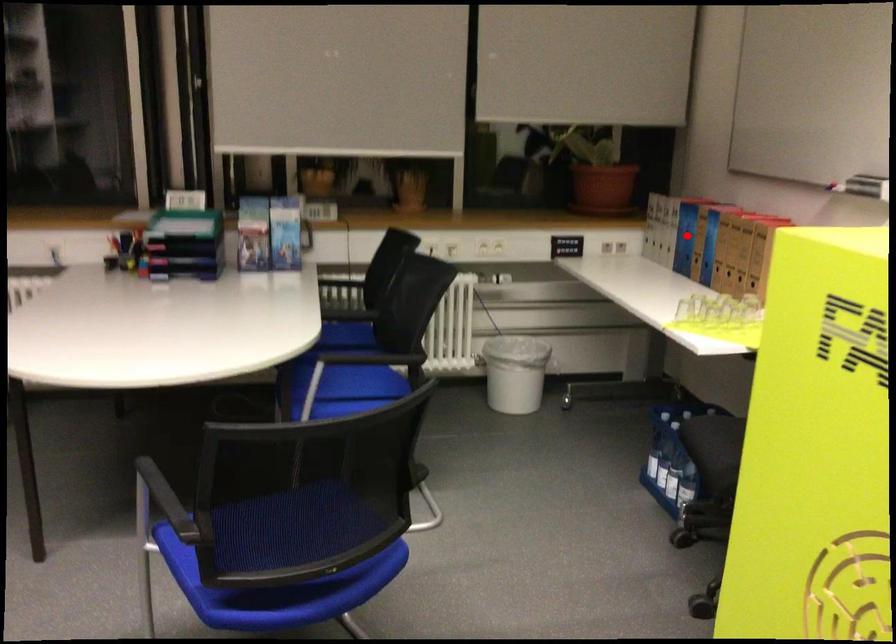
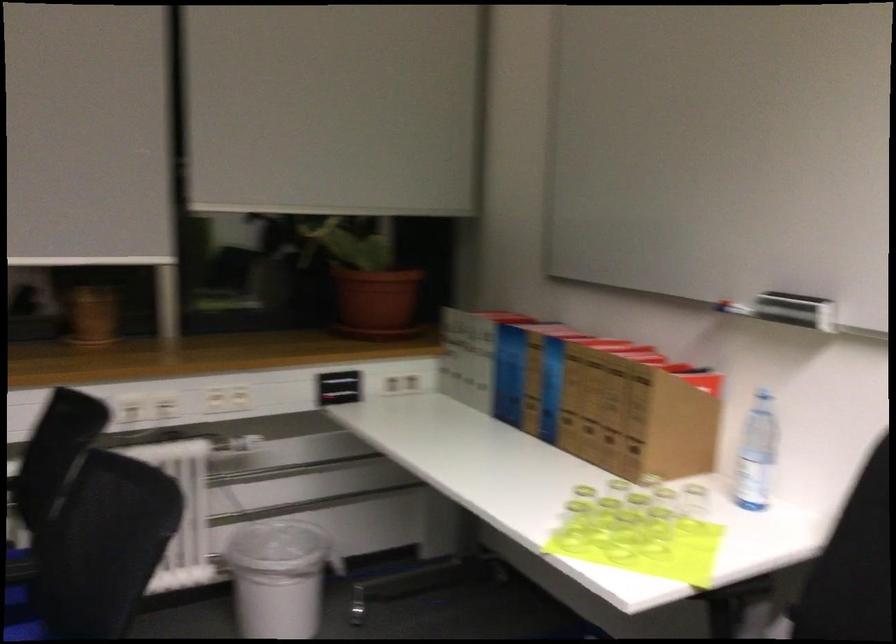
Question: I am providing you with two images of the same scene from different viewpoints. Image1 has a red point marked. In image2, the corresponding 3D location appears at what relative position? Reply with the corresponding letter.

Choices:
 (A) Closer
 (B) Farther

Answer: (A)